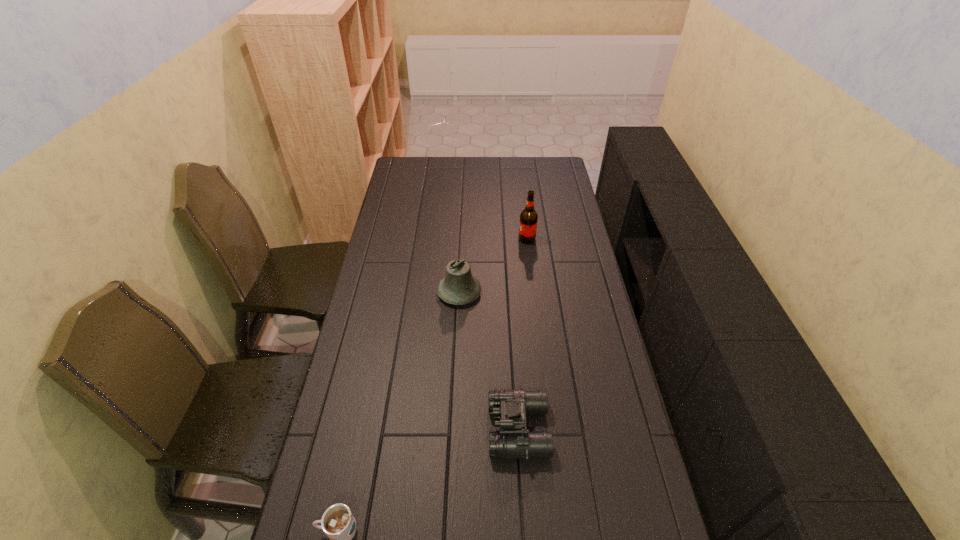
The height and width of the screenshot is (540, 960). In order to click on free location at the far edge in this screenshot , I will do `click(492, 168)`.

Identify the location of vacant region at the left edge of the desktop. (404, 188).

Where is `free space at the right edge`? The height and width of the screenshot is (540, 960). free space at the right edge is located at coordinates (567, 266).

This screenshot has height=540, width=960. I want to click on vacant space at the far left corner, so click(408, 166).

In the image, there is a desktop. At what (x,y) coordinates should I click in order to perform the action: click on vacant space at the far right corner. Please return your answer as a coordinate pair (x, y). This screenshot has width=960, height=540. Looking at the image, I should click on (547, 179).

The width and height of the screenshot is (960, 540). In order to click on vacant space in between the third shortest object and the second nearest object in this screenshot , I will do `click(489, 361)`.

Locate an element on the screen. This screenshot has height=540, width=960. free space between the third shortest object and the third farthest object is located at coordinates (489, 361).

At what (x,y) coordinates should I click in order to perform the action: click on free point between the tallest object and the third object from right to left. Please return your answer as a coordinate pair (x, y). The width and height of the screenshot is (960, 540). Looking at the image, I should click on (493, 266).

Where is `free space between the root beer and the second farthest object`? The width and height of the screenshot is (960, 540). free space between the root beer and the second farthest object is located at coordinates (493, 266).

This screenshot has width=960, height=540. In order to click on free spot between the third shortest object and the second nearest object in this screenshot , I will do `click(489, 361)`.